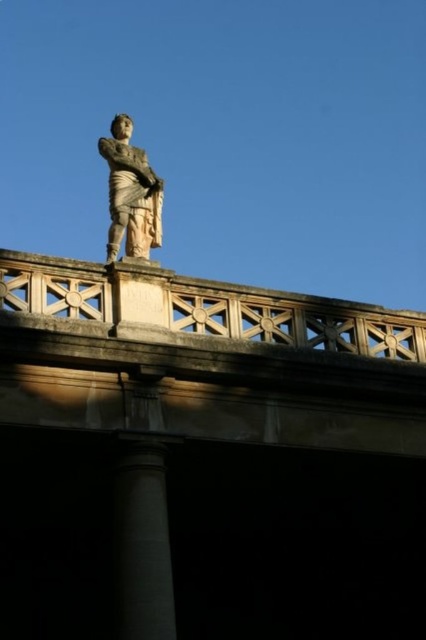
You are an architect examining the classical structure. You notice the smooth gray column at center and the stone statue at center. Which object has a greater width?

The stone statue at center has a greater width than the smooth gray column at center.

You are an architect examining the classical structure. You notice the smooth gray column at center and the stone statue at center. Which object is closer to you from your current viewpoint?

The smooth gray column at center is closer to you because it is positioned in front of the stone statue at center.

You are an architect analyzing the classical structure. You need to determine which object, the white stone bridge at upper center or the smooth gray column at center, has a greater height. Based on the scene, which one is taller?

The white stone bridge at upper center is taller than the smooth gray column at center according to the description.